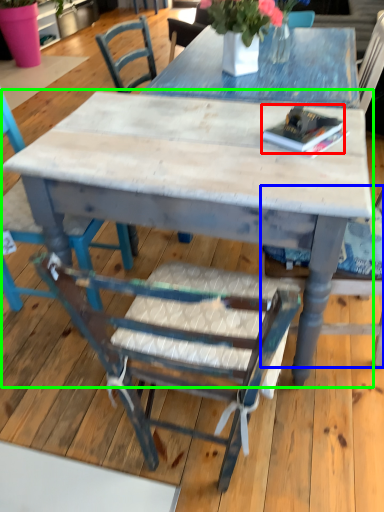
Question: Which object is the farthest from book (highlighted by a red box)? Choose among these: chair (highlighted by a blue box) or kitchen & dining room table (highlighted by a green box).

Choices:
 (A) chair
 (B) kitchen & dining room table

Answer: (A)